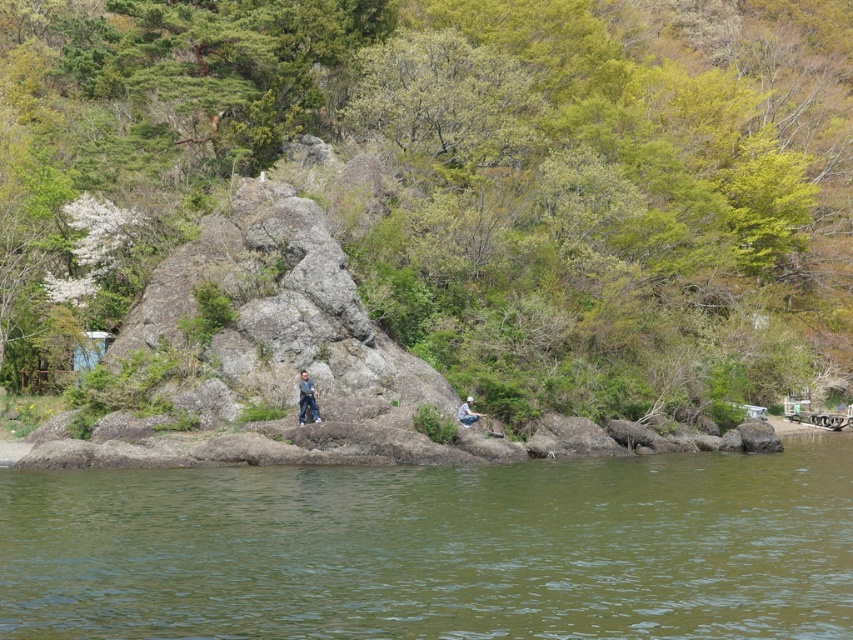
You are a photographer planning to take a photo of the green leafy tree at upper center and the denim pants at center. Based on their sizes in the image, which object would appear larger in your photo?

The green leafy tree at upper center would appear larger in the photo because it is much taller than the denim pants at center.

You are a photographer aiming to capture a shot of the green leafy tree at upper center and the denim pants at center. Based on their positions, can you determine which object is higher in the image?

The green leafy tree at upper center is located above the denim pants at center, so the green leafy tree at upper center is higher in the image.